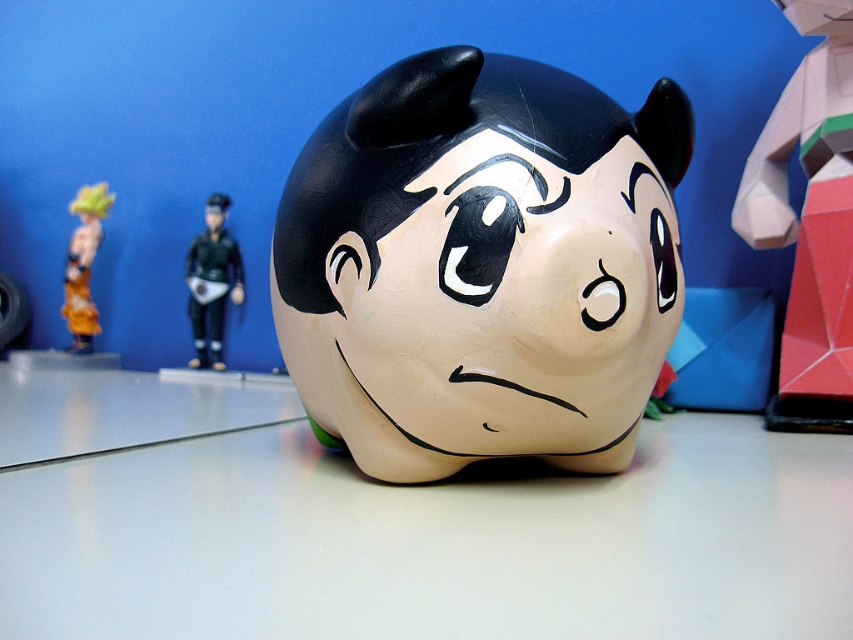
Question: Which object is farther from the camera taking this photo?

Choices:
 (A) orange fabric toy at left
 (B) matte black face at center
 (C) geometric paper model at right

Answer: (A)

Question: Does geometric paper model at right appear on the left side of black matte figure at left?

Choices:
 (A) no
 (B) yes

Answer: (A)

Question: Which object is positioned farthest from the black matte figure at left?

Choices:
 (A) geometric paper model at right
 (B) orange fabric toy at left
 (C) matte black face at center

Answer: (C)

Question: Which of the following is the farthest from the observer?

Choices:
 (A) (73, 209)
 (B) (207, 330)
 (C) (548, 392)

Answer: (A)

Question: Is the position of matte black face at center less distant than that of geometric paper model at right?

Choices:
 (A) yes
 (B) no

Answer: (A)

Question: Can you confirm if matte black face at center is bigger than orange fabric toy at left?

Choices:
 (A) yes
 (B) no

Answer: (A)